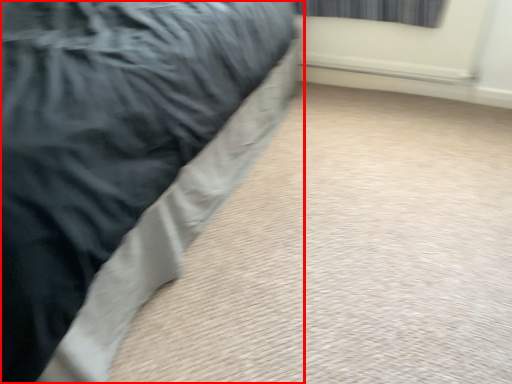
Question: Observing the image, what is the correct spatial positioning of bed (annotated by the red box) in reference to curtain?

Choices:
 (A) left
 (B) right

Answer: (A)